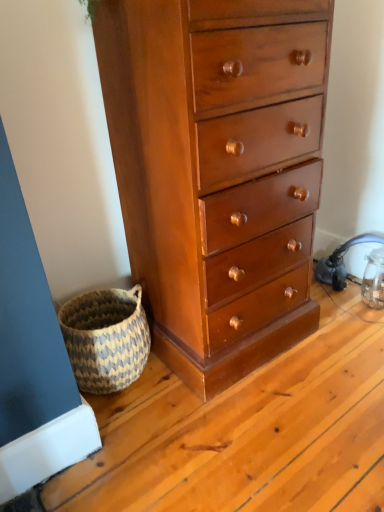
Question: Considering the relative sizes of natural woven basket at lower left and shiny brown wood chest of drawers at center in the image provided, is natural woven basket at lower left taller than shiny brown wood chest of drawers at center?

Choices:
 (A) no
 (B) yes

Answer: (A)

Question: Can you confirm if natural woven basket at lower left is positioned to the right of shiny brown wood chest of drawers at center?

Choices:
 (A) no
 (B) yes

Answer: (A)

Question: Can you confirm if natural woven basket at lower left is wider than shiny brown wood chest of drawers at center?

Choices:
 (A) no
 (B) yes

Answer: (A)

Question: From a real-world perspective, is natural woven basket at lower left on top of shiny brown wood chest of drawers at center?

Choices:
 (A) yes
 (B) no

Answer: (B)

Question: Considering the relative sizes of natural woven basket at lower left and shiny brown wood chest of drawers at center in the image provided, is natural woven basket at lower left smaller than shiny brown wood chest of drawers at center?

Choices:
 (A) no
 (B) yes

Answer: (B)

Question: Does natural woven basket at lower left turn towards shiny brown wood chest of drawers at center?

Choices:
 (A) no
 (B) yes

Answer: (A)

Question: Is shiny brown wood chest of drawers at center next to natural woven basket at lower left?

Choices:
 (A) no
 (B) yes

Answer: (A)

Question: From a real-world perspective, is shiny brown wood chest of drawers at center under natural woven basket at lower left?

Choices:
 (A) yes
 (B) no

Answer: (B)

Question: From the image's perspective, is shiny brown wood chest of drawers at center located beneath natural woven basket at lower left?

Choices:
 (A) no
 (B) yes

Answer: (A)

Question: Considering the relative sizes of shiny brown wood chest of drawers at center and natural woven basket at lower left in the image provided, is shiny brown wood chest of drawers at center shorter than natural woven basket at lower left?

Choices:
 (A) no
 (B) yes

Answer: (A)

Question: Considering the relative sizes of shiny brown wood chest of drawers at center and natural woven basket at lower left in the image provided, is shiny brown wood chest of drawers at center taller than natural woven basket at lower left?

Choices:
 (A) no
 (B) yes

Answer: (B)

Question: Is the position of shiny brown wood chest of drawers at center more distant than that of natural woven basket at lower left?

Choices:
 (A) no
 (B) yes

Answer: (A)

Question: Considering the positions of natural woven basket at lower left and shiny brown wood chest of drawers at center in the image, is natural woven basket at lower left taller or shorter than shiny brown wood chest of drawers at center?

Choices:
 (A) tall
 (B) short

Answer: (B)